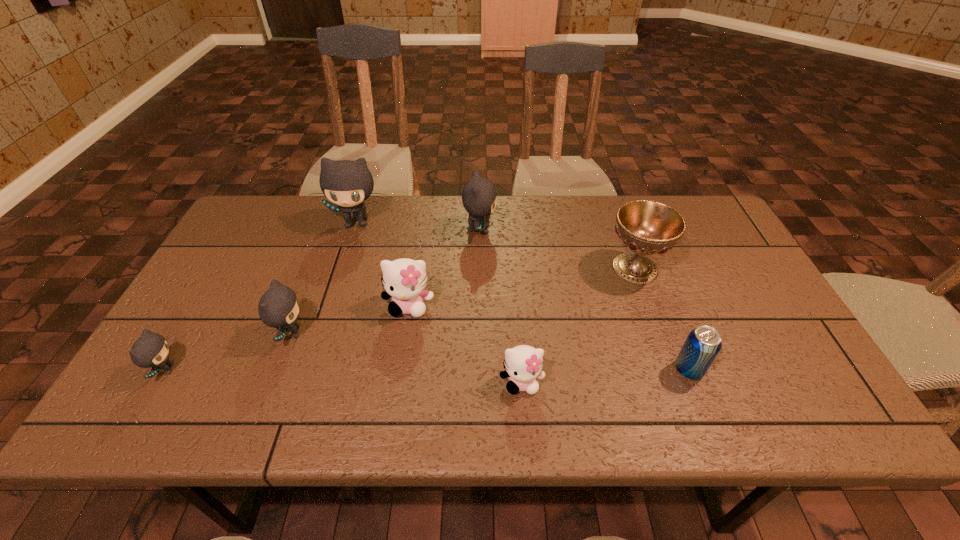
This screenshot has height=540, width=960. I want to click on the fifth closest kitten relative to the second smallest gray kitten, so click(x=523, y=363).

Identify which gray kitten is the nearest to the third biggest gray kitten. Please provide its 2D coordinates. Your answer should be formatted as a tuple, i.e. [(x, y)], where the tuple contains the x and y coordinates of a point satisfying the conditions above.

[(151, 350)]

You are a GUI agent. You are given a task and a screenshot of the screen. Output one action in this format:
    pyautogui.click(x=<x>, y=<y>)
    Task: Click on the gray kitten that stands as the third closest to the chalice
    The height and width of the screenshot is (540, 960).
    Given the screenshot: What is the action you would take?
    pyautogui.click(x=278, y=307)

The width and height of the screenshot is (960, 540). In order to click on free spot that satisfies the following two spatial constraints: 1. on the front-facing side of the second biggest gray kitten; 2. on the back side of the chalice in this screenshot , I will do click(479, 268).

Where is `free location that satisfies the following two spatial constraints: 1. on the front-facing side of the blue beer can; 2. on the right side of the tallest kitten`? This screenshot has width=960, height=540. free location that satisfies the following two spatial constraints: 1. on the front-facing side of the blue beer can; 2. on the right side of the tallest kitten is located at coordinates (310, 369).

Locate an element on the screen. This screenshot has height=540, width=960. vacant space that satisfies the following two spatial constraints: 1. on the front-facing side of the blue beer can; 2. on the right side of the tallest kitten is located at coordinates (310, 369).

The height and width of the screenshot is (540, 960). Identify the location of free region that satisfies the following two spatial constraints: 1. on the front-facing side of the blue beer can; 2. on the left side of the third biggest gray kitten. (277, 369).